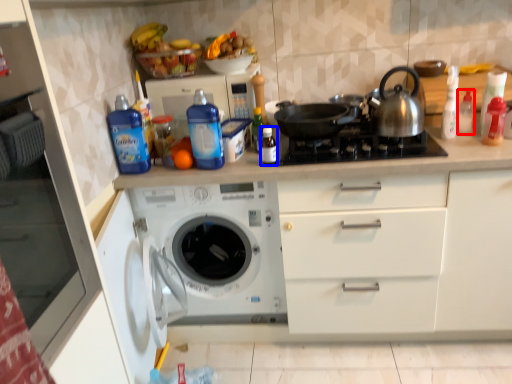
Question: Which object is closer to the camera taking this photo, bottle (highlighted by a red box) or bottle (highlighted by a blue box)?

Choices:
 (A) bottle
 (B) bottle

Answer: (B)